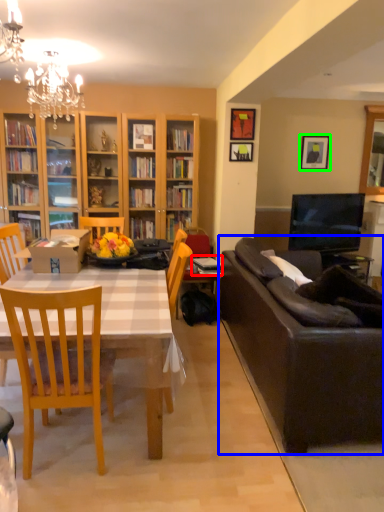
Question: Which is farther away from book (highlighted by a red box)? studio couch (highlighted by a blue box) or picture frame (highlighted by a green box)?

Choices:
 (A) studio couch
 (B) picture frame

Answer: (B)